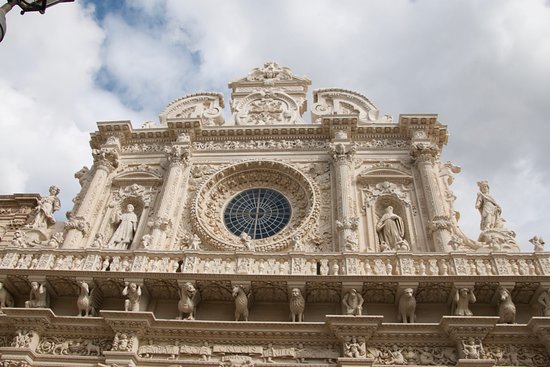
At what (x,y) coordinates should I click in order to perform the action: click on columns. Please return your answer as a coordinate pair (x, y). The width and height of the screenshot is (550, 367). Looking at the image, I should click on (422, 161), (342, 163), (185, 166), (108, 172).